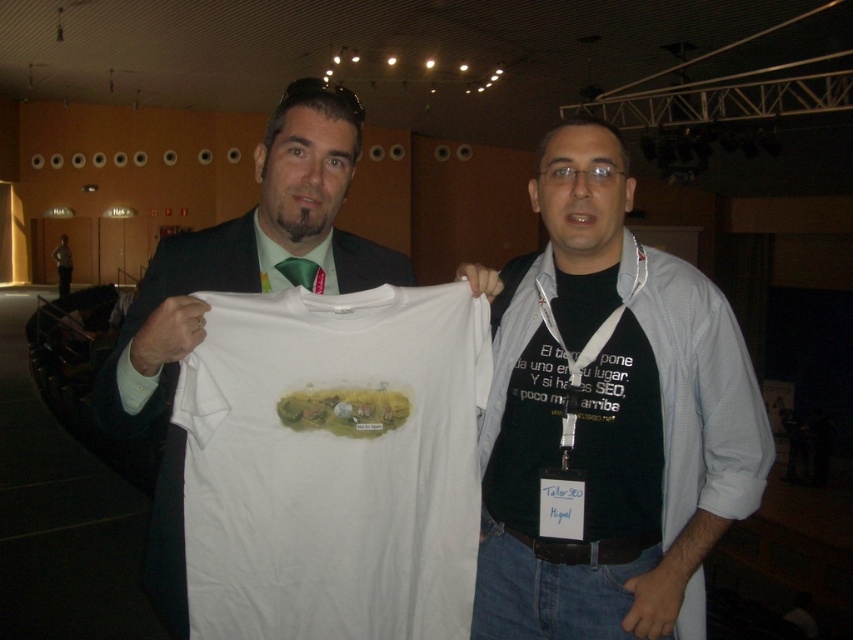
Question: Which object is closer to the camera taking this photo?

Choices:
 (A) white cotton t-shirt at center
 (B) green silk tie at upper center

Answer: (A)

Question: Which of the following is the farthest from the observer?

Choices:
 (A) (578, 602)
 (B) (328, 552)

Answer: (A)

Question: Is white cotton t-shirt at center bigger than black cotton shirt at center?

Choices:
 (A) yes
 (B) no

Answer: (B)

Question: Does white cotton t-shirt at center have a larger size compared to green silk tie at upper center?

Choices:
 (A) yes
 (B) no

Answer: (A)

Question: Is white cotton t-shirt at center in front of black cotton shirt at center?

Choices:
 (A) yes
 (B) no

Answer: (A)

Question: Considering the real-world distances, which object is farthest from the black cotton shirt at center?

Choices:
 (A) white cotton t-shirt at center
 (B) green silk tie at upper center

Answer: (B)